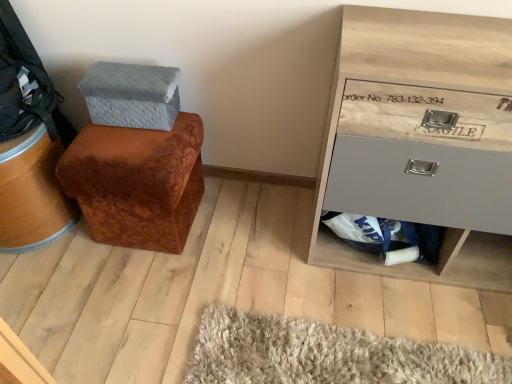
The width and height of the screenshot is (512, 384). I want to click on free space in front of brown velvety ottoman at left, so (x=131, y=296).